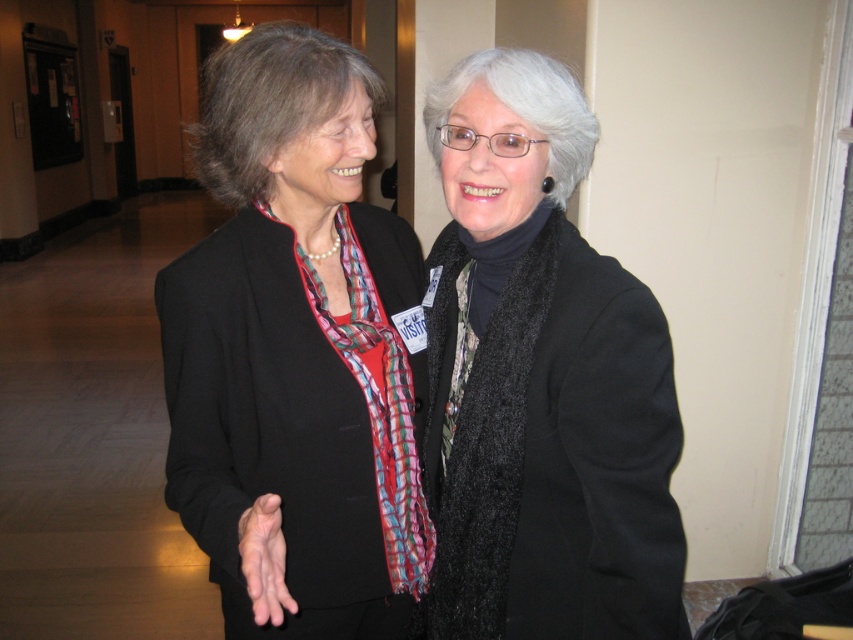
Question: Is matte black blazer at center bigger than black fuzzy scarf at center?

Choices:
 (A) no
 (B) yes

Answer: (B)

Question: Is matte black blazer at center above black fuzzy scarf at center?

Choices:
 (A) no
 (B) yes

Answer: (B)

Question: Which object appears farthest from the camera in this image?

Choices:
 (A) black fuzzy scarf at center
 (B) matte black blazer at center

Answer: (A)

Question: Does matte black blazer at center appear under black fuzzy scarf at center?

Choices:
 (A) no
 (B) yes

Answer: (A)